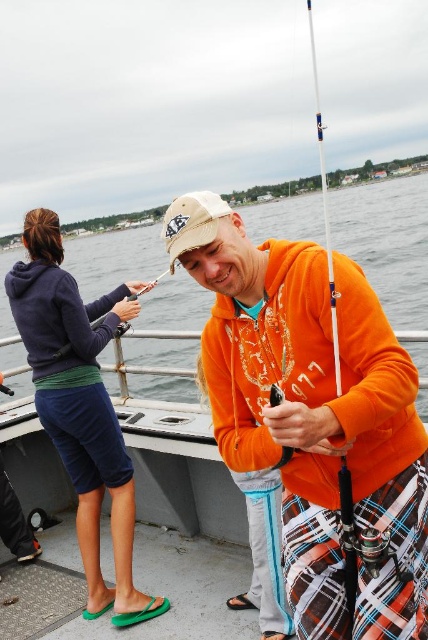
You are standing on the boat and want to hand a fishing tool to the person wearing the matte orange hoodie at center. Where should you look to find them?

The person wearing the matte orange hoodie at center is located at the 2D coordinates point (388,243), so you should look towards that point to find them.